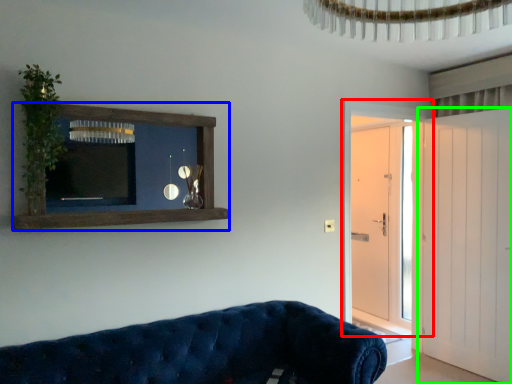
Question: Based on their relative distances, which object is nearer to door (highlighted by a red box)? Choose from shelf (highlighted by a blue box) and door (highlighted by a green box).

Choices:
 (A) shelf
 (B) door

Answer: (B)